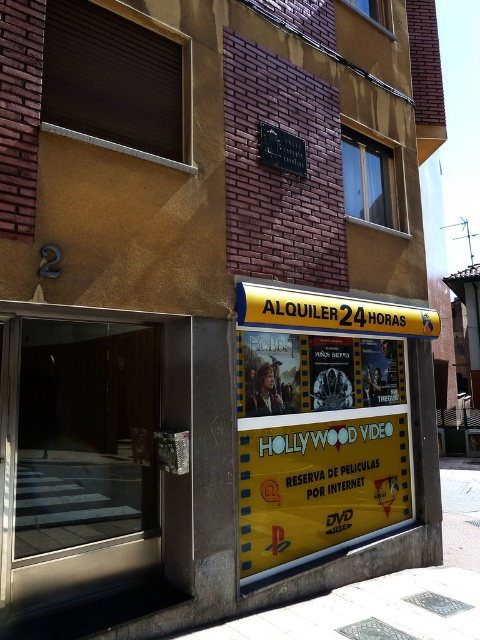
Is yellow filmstrip at center positioned in front of white concrete pavement at lower center?

No.

Does point (326, 387) lie behind point (384, 611)?

That is True.

The image size is (480, 640). I want to click on yellow filmstrip at center, so click(x=317, y=444).

Can you confirm if transparent glass door at left is bigger than yellow filmstrip at center?

Actually, transparent glass door at left might be smaller than yellow filmstrip at center.

How distant is transparent glass door at left from yellow filmstrip at center?

transparent glass door at left and yellow filmstrip at center are 4.62 feet apart from each other.

What do you see at coordinates (82, 461) in the screenshot? I see `transparent glass door at left` at bounding box center [82, 461].

Locate an element on the screen. The height and width of the screenshot is (640, 480). transparent glass door at left is located at coordinates (82, 461).

Is transparent glass door at left further to camera compared to white concrete pavement at lower center?

That is False.

Is transparent glass door at left shorter than white concrete pavement at lower center?

No, transparent glass door at left is not shorter than white concrete pavement at lower center.

Is point (60, 618) closer to camera compared to point (372, 620)?

Yes, point (60, 618) is in front of point (372, 620).

You are a GUI agent. You are given a task and a screenshot of the screen. Output one action in this format:
    pyautogui.click(x=<x>, y=<y>)
    Task: Click on the transparent glass door at left
    Image resolution: width=480 pixels, height=640 pixels.
    Given the screenshot: What is the action you would take?
    pyautogui.click(x=82, y=461)